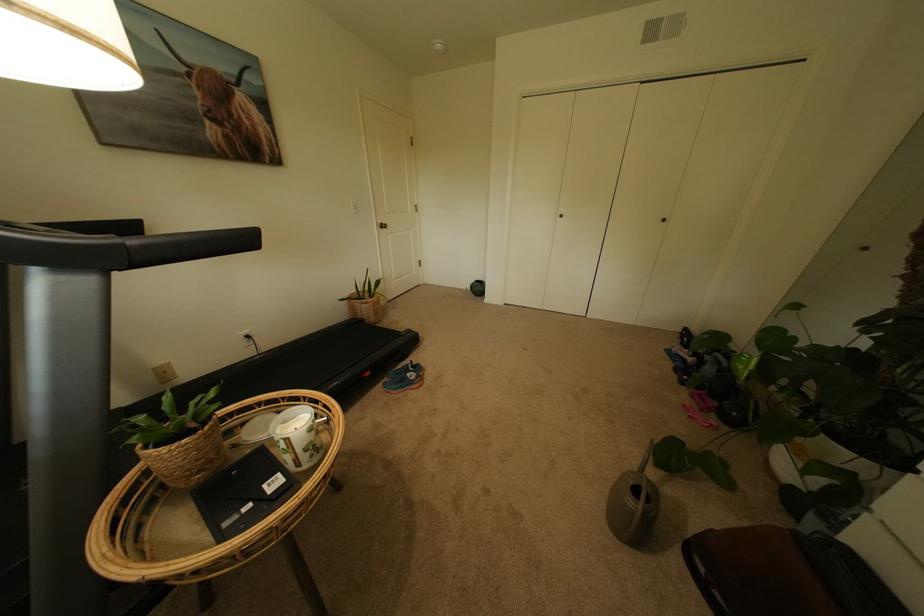
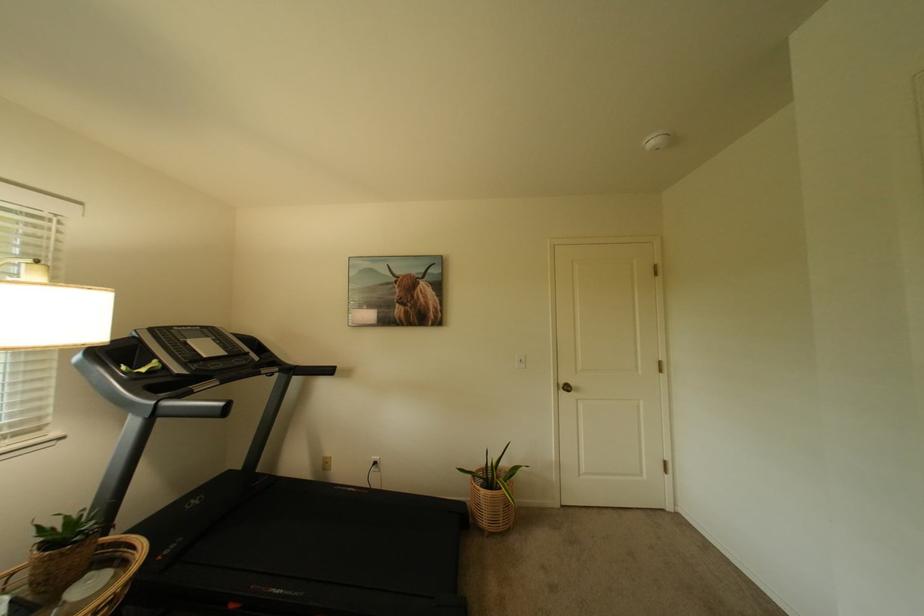
Find the pixel in the second image that matches (387,225) in the first image.

(569, 386)